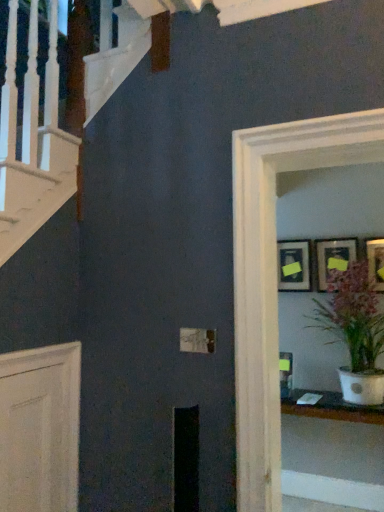
Question: Looking at their shapes, would you say white glossy pot at center-right is wider or thinner than matte black picture frame at upper right, acting as the 3th picture frame starting from the right?

Choices:
 (A) thin
 (B) wide

Answer: (B)

Question: Looking at the image, does white glossy pot at center-right seem bigger or smaller compared to matte black picture frame at upper right, acting as the 3th picture frame starting from the right?

Choices:
 (A) big
 (B) small

Answer: (A)

Question: Which is farther from the white glossy glass door at upper right?

Choices:
 (A) matte black picture frame at upper right, which appears as the 2th picture frame when viewed from the right
 (B) matte black picture frame at upper right, which is the first picture frame from left to right
 (C) matte black picture frame at upper right, the 1th picture frame viewed from the right
 (D) white glossy table at lower right
 (E) white glossy pot at center-right

Answer: (D)

Question: Based on their relative distances, which object is nearer to the white glossy pot at center-right?

Choices:
 (A) white glossy glass door at upper right
 (B) matte black picture frame at upper right, the 3th picture frame when ordered from left to right
 (C) white glossy table at lower right
 (D) matte black picture frame at upper right, which is the first picture frame from left to right
 (E) matte black picture frame at upper right, which appears as the 2th picture frame when viewed from the right

Answer: (B)